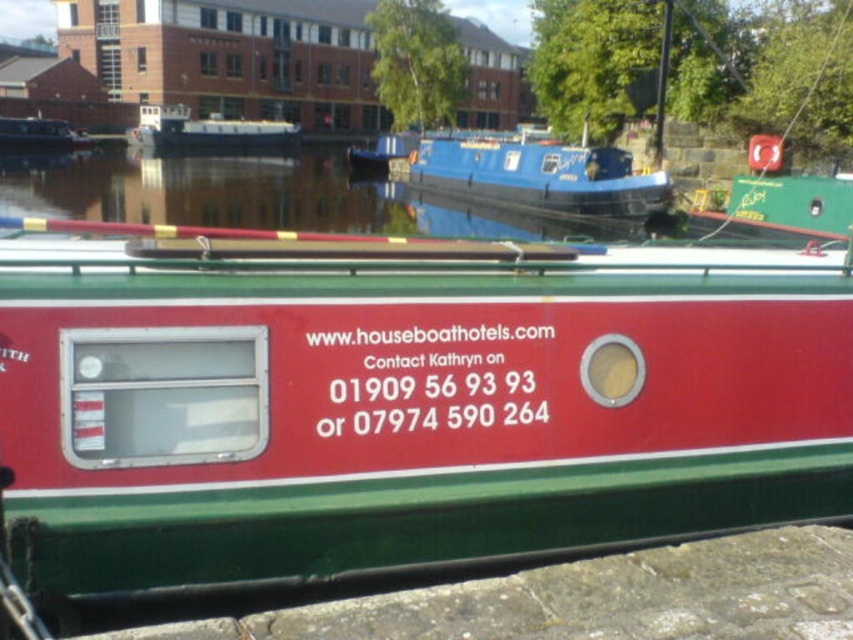
Question: Which is nearer to the white glossy houseboat at center?

Choices:
 (A) matte black boat at upper left
 (B) blue glossy houseboat at center
 (C) matte red boat at center

Answer: (A)

Question: Among these points, which one is nearest to the camera?

Choices:
 (A) (612, 193)
 (B) (192, 140)
 (C) (51, 147)

Answer: (A)

Question: From the image, what is the correct spatial relationship of blue glossy houseboat at center in relation to matte black boat at upper left?

Choices:
 (A) right
 (B) left

Answer: (A)

Question: Which point is farther to the camera?

Choices:
 (A) (451, 136)
 (B) (828, 378)
 (C) (199, 124)

Answer: (C)

Question: Can you confirm if matte red boat at center is positioned to the right of blue glossy houseboat at center?

Choices:
 (A) yes
 (B) no

Answer: (B)

Question: From the image, what is the correct spatial relationship of white glossy houseboat at center in relation to matte black boat at upper left?

Choices:
 (A) below
 (B) above

Answer: (B)